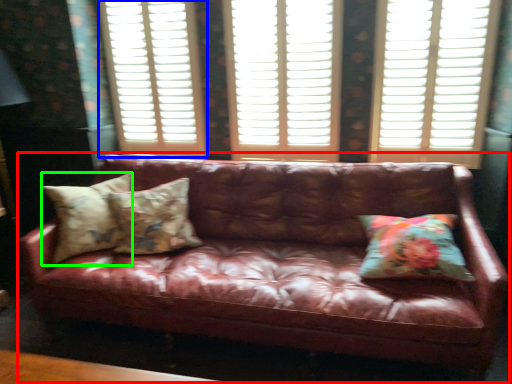
Question: Based on their relative distances, which object is nearer to studio couch (highlighted by a red box)? Choose from window frame (highlighted by a blue box) and pillow (highlighted by a green box).

Choices:
 (A) window frame
 (B) pillow

Answer: (B)